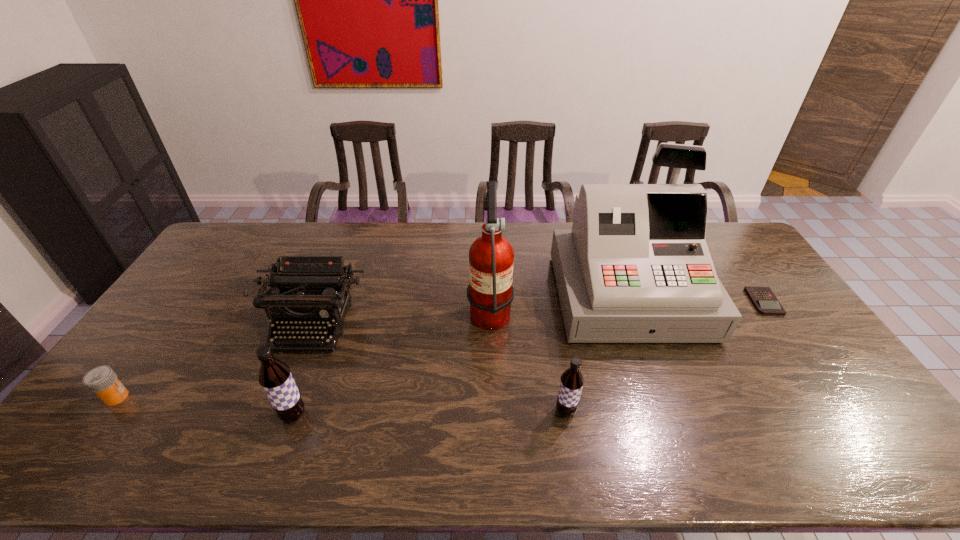
Locate an element on the screen. typewriter is located at coordinates (321, 283).

This screenshot has width=960, height=540. I want to click on vacant area situated 0.230m on the back of the fifth shortest object, so click(x=322, y=336).

Identify the location of vacant region located 0.250m on the right of the right root beer. (675, 411).

What are the coordinates of `free spot located on the left of the rightmost object` in the screenshot? It's located at (658, 302).

Find the location of a particular element. free space located on the nozzle and handle of the fire extinguisher is located at coordinates (404, 309).

The width and height of the screenshot is (960, 540). I want to click on vacant space situated on the nozzle and handle of the fire extinguisher, so click(360, 309).

Identify the location of free space located 0.210m on the nozzle and handle of the fire extinguisher. Image resolution: width=960 pixels, height=540 pixels. (401, 309).

Identify the location of free space located on the keypad side of the cash register. The image size is (960, 540). (660, 381).

Where is `vacant space positioned on the label side of the leftmost object`? This screenshot has width=960, height=540. vacant space positioned on the label side of the leftmost object is located at coordinates (178, 397).

The height and width of the screenshot is (540, 960). What are the coordinates of `free point located on the keyboard of the typewriter` in the screenshot? It's located at (279, 411).